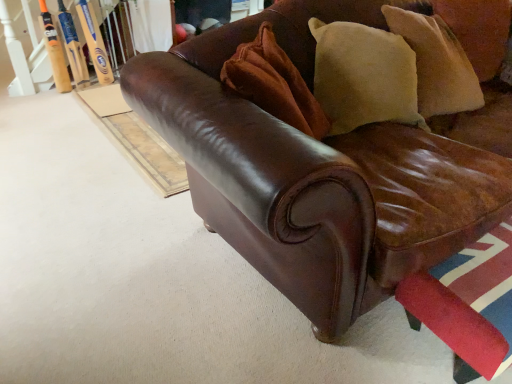
Question: Do you think wooden baseball bat at upper left, which is the first baseball bat from right to left, is within velvet beige pillow at upper right, marked as the second pillow in a right-to-left arrangement, or outside of it?

Choices:
 (A) outside
 (B) inside

Answer: (A)

Question: From the image's perspective, relative to velvet beige pillow at upper right, arranged as the 1th pillow when viewed from the left, is wooden baseball bat at upper left, which is the first baseball bat from right to left, above or below?

Choices:
 (A) below
 (B) above

Answer: (B)

Question: Estimate the real-world distances between objects in this image. Which object is closer to the orange wood baseball bat at upper left, the 2th baseball bat from the right?

Choices:
 (A) wooden baseball bat at upper left, which is the first baseball bat from right to left
 (B) beige suede pillow at upper right, the second pillow when ordered from left to right
 (C) brown leather couch at center
 (D) velvet beige pillow at upper right, arranged as the 1th pillow when viewed from the left
 (E) rubberized red swivel chair at lower right

Answer: (A)

Question: Which is farther from the wooden baseball bat at upper left, the 2th baseball bat when ordered from left to right?

Choices:
 (A) rubberized red swivel chair at lower right
 (B) orange wood baseball bat at upper left, the first baseball bat when ordered from left to right
 (C) velvet beige pillow at upper right, marked as the second pillow in a right-to-left arrangement
 (D) beige suede pillow at upper right, which ranks as the 2th pillow in front-to-back order
 (E) brown leather couch at center

Answer: (A)